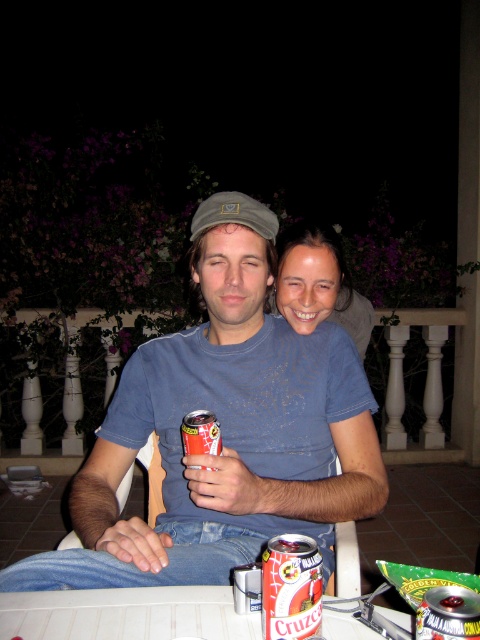
Question: Which object appears closest to the camera in this image?

Choices:
 (A) metallic red can at center
 (B) metallic silver can at center

Answer: (B)

Question: Can you confirm if white plastic table at lower center is bigger than metallic silver can at center?

Choices:
 (A) yes
 (B) no

Answer: (A)

Question: Which of the following is the closest to the observer?

Choices:
 (A) white plastic table at lower center
 (B) crimson matte can at lower center

Answer: (B)

Question: Which point appears closest to the camera in this image?

Choices:
 (A) (479, 595)
 (B) (288, 589)
 (C) (203, 413)
 (D) (219, 291)

Answer: (A)

Question: Is matte blue t-shirt at center thinner than metallic red can at center?

Choices:
 (A) no
 (B) yes

Answer: (A)

Question: Can you confirm if matte blue t-shirt at center is bigger than crimson matte can at lower center?

Choices:
 (A) yes
 (B) no

Answer: (A)